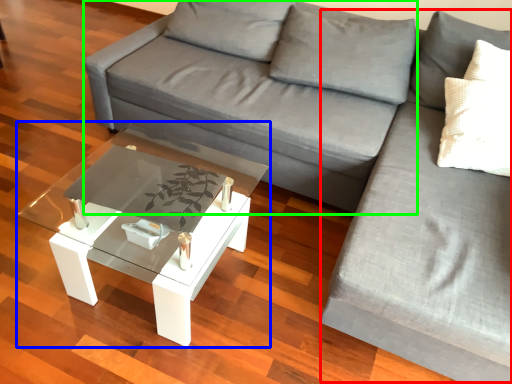
Question: Which object is the farthest from couch (highlighted by a red box)? Choose among these: coffee table (highlighted by a blue box) or couch (highlighted by a green box).

Choices:
 (A) coffee table
 (B) couch

Answer: (A)